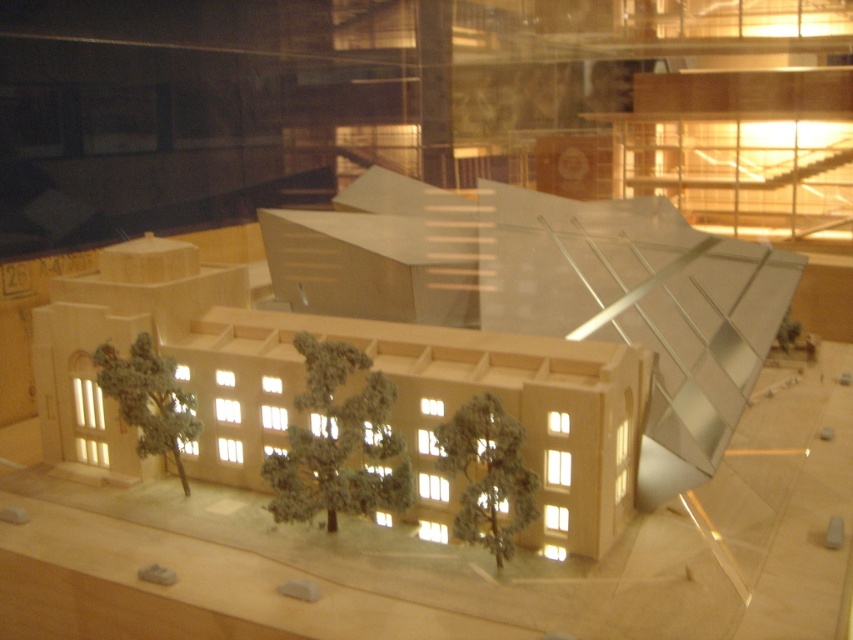
Between green textured tree at center and green matte tree at lower left, which one has less height?

green matte tree at lower left

Does green textured tree at center appear under green matte tree at lower left?

Yes.

Is point (300, 433) positioned behind point (167, 428)?

No.

This screenshot has height=640, width=853. Identify the location of green textured tree at center. (339, 442).

Does green matte tree at center have a lesser width compared to green matte tree at lower left?

Indeed, green matte tree at center has a lesser width compared to green matte tree at lower left.

This screenshot has height=640, width=853. What are the coordinates of `green matte tree at center` in the screenshot? It's located at (486, 476).

Can you confirm if green textured tree at center is thinner than green matte tree at center?

Incorrect, green textured tree at center's width is not less than green matte tree at center's.

Between point (366, 432) and point (497, 403), which one is positioned behind?

The point (366, 432) is more distant.

Image resolution: width=853 pixels, height=640 pixels. What are the coordinates of `green textured tree at center` in the screenshot? It's located at (339, 442).

This screenshot has width=853, height=640. What are the coordinates of `green textured tree at center` in the screenshot? It's located at (339, 442).